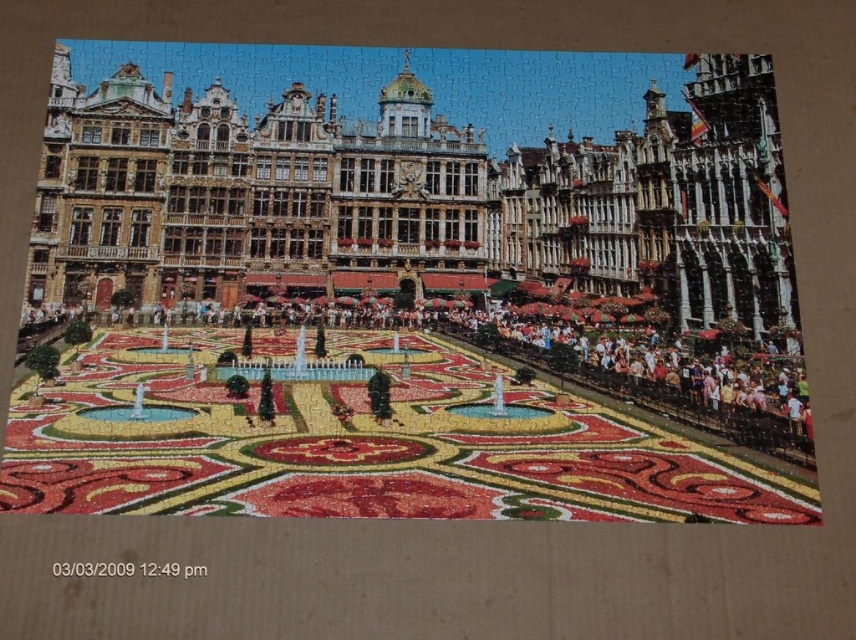
Question: Is golden stone palace at upper center below floral carpet at center?

Choices:
 (A) yes
 (B) no

Answer: (B)

Question: Can you confirm if golden stone palace at upper center is wider than floral carpet at center?

Choices:
 (A) no
 (B) yes

Answer: (B)

Question: Can you confirm if golden stone palace at upper center is bigger than floral carpet at center?

Choices:
 (A) no
 (B) yes

Answer: (B)

Question: Among these points, which one is nearest to the camera?

Choices:
 (A) (337, 157)
 (B) (432, 515)

Answer: (B)